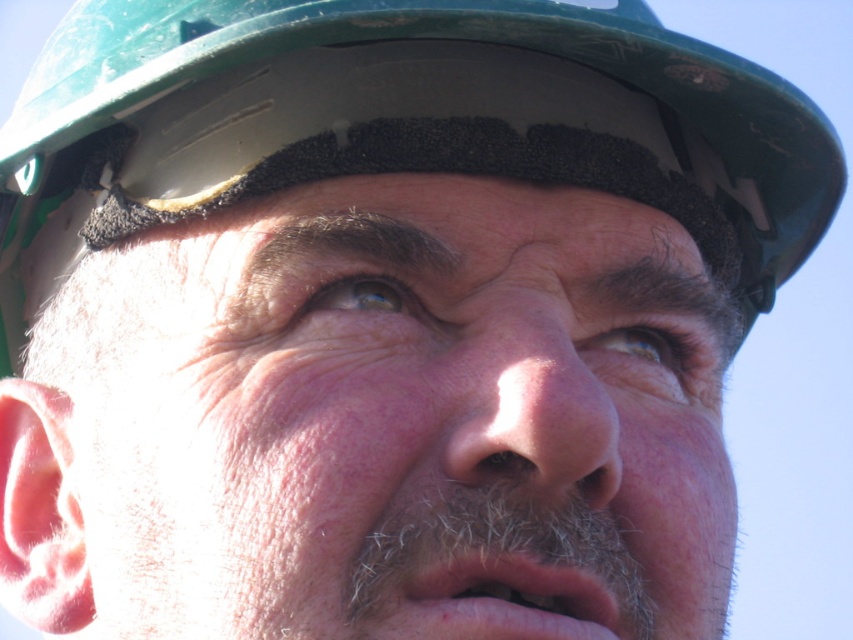
Question: Does green matte hard hat at upper center have a smaller size compared to gray fuzzy beard at lower center?

Choices:
 (A) yes
 (B) no

Answer: (B)

Question: Which of the following is the closest to the observer?

Choices:
 (A) green matte hard hat at upper center
 (B) dry skin at center

Answer: (B)

Question: Which point is farther to the camera?

Choices:
 (A) green matte hard hat at upper center
 (B) gray fuzzy beard at lower center
 (C) dry skin at center

Answer: (A)

Question: Which of the following is the farthest from the observer?

Choices:
 (A) green matte hard hat at upper center
 (B) dry skin at center
 (C) pink matte/natural skin at center

Answer: (A)

Question: Can you confirm if green matte hard hat at upper center is wider than gray fuzzy beard at lower center?

Choices:
 (A) yes
 (B) no

Answer: (A)

Question: Can you confirm if green matte hard hat at upper center is positioned to the left of gray fuzzy beard at lower center?

Choices:
 (A) yes
 (B) no

Answer: (A)